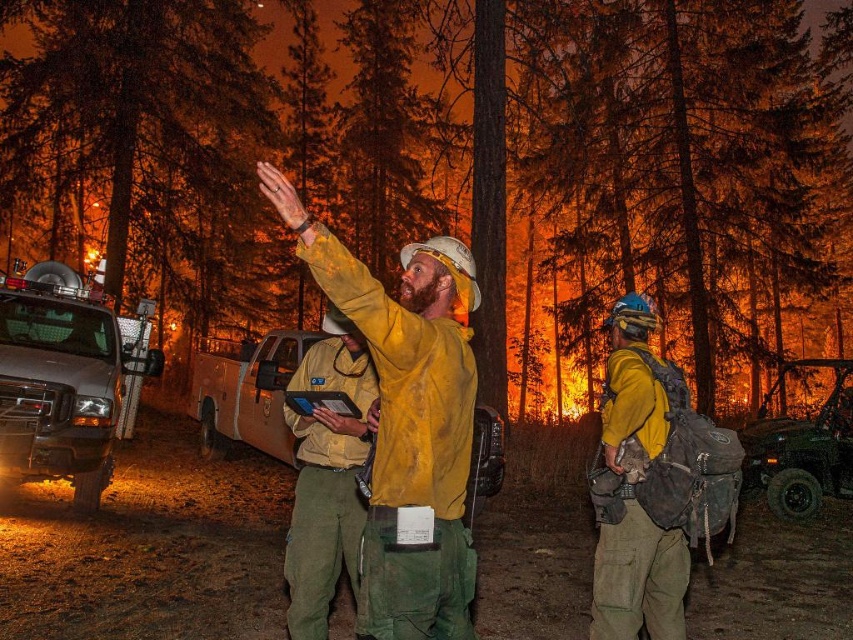
Is point (459, 292) behind point (320, 634)?

That is False.

Which is behind, point (305, 221) or point (338, 532)?

Point (338, 532)

Measure the distance between point (x=434, y=577) and camera.

Point (x=434, y=577) and camera are 8.32 feet apart.

The width and height of the screenshot is (853, 640). Find the location of `yellow fire-resistant suit at center`. yellow fire-resistant suit at center is located at coordinates (407, 419).

Image resolution: width=853 pixels, height=640 pixels. What do you see at coordinates (407, 419) in the screenshot? I see `yellow fire-resistant suit at center` at bounding box center [407, 419].

Between yellow fire-resistant suit at center and brushed metal truck at left, which one appears on the left side from the viewer's perspective?

From the viewer's perspective, brushed metal truck at left appears more on the left side.

Between point (469, 554) and point (109, 369), which one is positioned behind?

Point (109, 369)

Where is `yellow fire-resistant suit at center`? The height and width of the screenshot is (640, 853). yellow fire-resistant suit at center is located at coordinates (407, 419).

Who is lower down, yellow fire-resistant jacket at center or brushed metal jeep at lower right?

brushed metal jeep at lower right is lower down.

Which is more to the left, yellow fire-resistant jacket at center or brushed metal jeep at lower right?

yellow fire-resistant jacket at center is more to the left.

Is point (332, 355) farther from camera compared to point (743, 426)?

No, it is in front of (743, 426).

I want to click on yellow fire-resistant jacket at center, so click(326, 476).